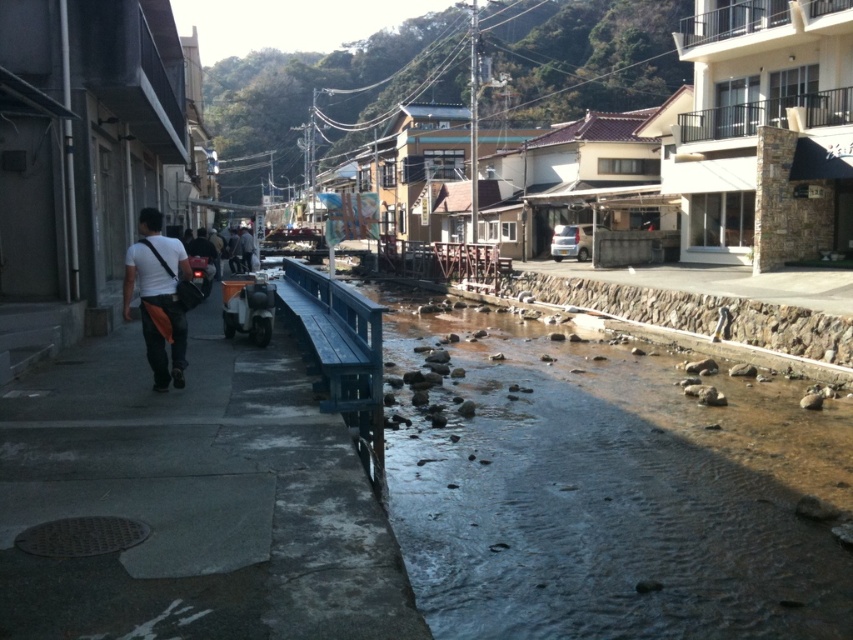
Question: Which of the following is the closest to the observer?

Choices:
 (A) (242, 264)
 (B) (526, 374)
 (C) (144, 326)
 (D) (242, 637)

Answer: (D)

Question: Is matte black bag at left wider than dark gray fabric jacket at center?

Choices:
 (A) no
 (B) yes

Answer: (A)

Question: Which point appears closest to the camera in this image?

Choices:
 (A) (99, 376)
 (B) (526, 400)
 (C) (245, 268)
 (D) (138, 296)

Answer: (D)

Question: Observing the image, what is the correct spatial positioning of clear water at center in reference to matte black bag at left?

Choices:
 (A) left
 (B) right

Answer: (B)

Question: Estimate the real-world distances between objects in this image. Which object is closer to the dark gray fabric jacket at center?

Choices:
 (A) clear water at center
 (B) matte black bag at left
 (C) concrete sidewalk at left

Answer: (A)

Question: Is clear water at center wider than concrete sidewalk at left?

Choices:
 (A) yes
 (B) no

Answer: (A)